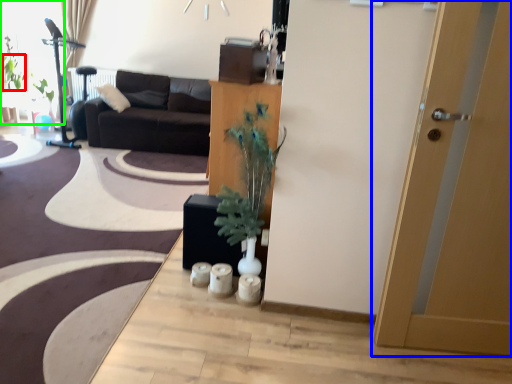
Question: Estimate the real-world distances between objects in this image. Which object is farther from plant (highlighted by a red box), door (highlighted by a blue box) or window screen (highlighted by a green box)?

Choices:
 (A) door
 (B) window screen

Answer: (A)